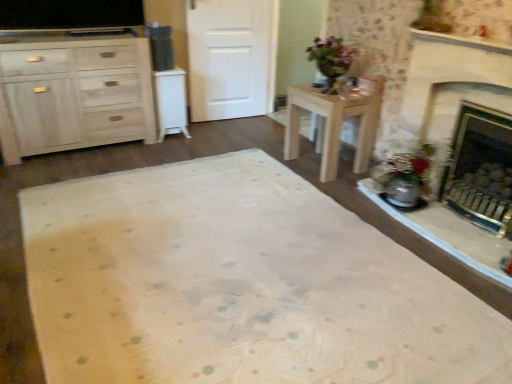
How much space does white matte cabinet at left, marked as the 1th cabinetry in a right-to-left arrangement, occupy vertically?

21.58 inches.

What do you see at coordinates (74, 93) in the screenshot?
I see `light wood cabinet at left, the first cabinetry when ordered from left to right` at bounding box center [74, 93].

Identify the location of light wood cabinet at left, the first cabinetry when ordered from left to right. (74, 93).

You are a GUI agent. You are given a task and a screenshot of the screen. Output one action in this format:
    pyautogui.click(x=<x>, y=<y>)
    Task: Click on the brass fireplace at right
    The width and height of the screenshot is (512, 384).
    Given the screenshot: What is the action you would take?
    pyautogui.click(x=448, y=91)

In the scene shown: What is the approximate width of white matte door at center?

The width of white matte door at center is 4.08 inches.

You are a GUI agent. You are given a task and a screenshot of the screen. Output one action in this format:
    pyautogui.click(x=<x>, y=<y>)
    Task: Click on the light wood desk at center
    
    Given the screenshot: What is the action you would take?
    pyautogui.click(x=334, y=125)

Can we say white matte door at center lies outside white matte cabinet at left, marked as the 1th cabinetry in a right-to-left arrangement?

white matte door at center is positioned outside white matte cabinet at left, marked as the 1th cabinetry in a right-to-left arrangement.

Are white matte door at center and white matte cabinet at left, marked as the 1th cabinetry in a right-to-left arrangement, beside each other?

No, white matte door at center is not touching white matte cabinet at left, marked as the 1th cabinetry in a right-to-left arrangement.

Is white matte door at center positioned with its back to white matte cabinet at left, positioned as the 2th cabinetry in left-to-right order?

No, white matte door at center is not facing away from white matte cabinet at left, positioned as the 2th cabinetry in left-to-right order.

Can you confirm if light wood desk at center is smaller than light wood cabinet at left, the first cabinetry when ordered from left to right?

Yes, light wood desk at center is smaller than light wood cabinet at left, the first cabinetry when ordered from left to right.

Does light wood desk at center turn towards light wood cabinet at left, the first cabinetry when ordered from left to right?

No.

Is light wood desk at center in contact with light wood cabinet at left, the first cabinetry when ordered from left to right?

No, light wood desk at center is not in contact with light wood cabinet at left, the first cabinetry when ordered from left to right.

Is brass fireplace at right closer to camera compared to light wood cabinet at left, arranged as the second cabinetry when viewed from the right?

Yes, it is in front of light wood cabinet at left, arranged as the second cabinetry when viewed from the right.

From the image's perspective, would you say brass fireplace at right is shown under light wood cabinet at left, the first cabinetry when ordered from left to right?

Yes, from the image's perspective, brass fireplace at right is beneath light wood cabinet at left, the first cabinetry when ordered from left to right.

From a real-world perspective, is brass fireplace at right over light wood cabinet at left, the first cabinetry when ordered from left to right?

Yes, from a real-world perspective, brass fireplace at right is over light wood cabinet at left, the first cabinetry when ordered from left to right

Where is `fireplace in front of the light wood cabinet at left, the first cabinetry when ordered from left to right`? The width and height of the screenshot is (512, 384). fireplace in front of the light wood cabinet at left, the first cabinetry when ordered from left to right is located at coordinates (448, 91).

Between light wood cabinet at left, arranged as the second cabinetry when viewed from the right, and light wood desk at center, which one is positioned behind?

light wood desk at center is further from the camera.

Is light wood cabinet at left, arranged as the second cabinetry when viewed from the right, positioned far away from light wood desk at center?

light wood cabinet at left, arranged as the second cabinetry when viewed from the right, is far away from light wood desk at center.

I want to click on desk behind the light wood cabinet at left, arranged as the second cabinetry when viewed from the right, so click(x=334, y=125).

Which is closer, (98, 132) or (338, 128)?

Clearly, point (98, 132) is more distant from the camera than point (338, 128).

Is brass fireplace at right not within light wood desk at center?

brass fireplace at right lies outside light wood desk at center's area.

Is brass fireplace at right touching light wood desk at center?

No, brass fireplace at right is not with light wood desk at center.

Is point (465, 256) less distant than point (324, 132)?

Yes, it is in front of point (324, 132).

Considering the sizes of objects light wood cabinet at left, arranged as the second cabinetry when viewed from the right, and white matte cabinet at left, marked as the 1th cabinetry in a right-to-left arrangement, in the image provided, who is taller, light wood cabinet at left, arranged as the second cabinetry when viewed from the right, or white matte cabinet at left, marked as the 1th cabinetry in a right-to-left arrangement,?

Standing taller between the two is light wood cabinet at left, arranged as the second cabinetry when viewed from the right.

Who is bigger, light wood cabinet at left, the first cabinetry when ordered from left to right, or white matte cabinet at left, marked as the 1th cabinetry in a right-to-left arrangement?

light wood cabinet at left, the first cabinetry when ordered from left to right, is bigger.

What's the angular difference between light wood cabinet at left, the first cabinetry when ordered from left to right, and white matte cabinet at left, positioned as the 2th cabinetry in left-to-right order,'s facing directions?

There is a 0.657-degree angle between the facing directions of light wood cabinet at left, the first cabinetry when ordered from left to right, and white matte cabinet at left, positioned as the 2th cabinetry in left-to-right order.

Is light wood cabinet at left, arranged as the second cabinetry when viewed from the right, to the left or to the right of white matte cabinet at left, positioned as the 2th cabinetry in left-to-right order, in the image?

In the image, light wood cabinet at left, arranged as the second cabinetry when viewed from the right, appears on the left side of white matte cabinet at left, positioned as the 2th cabinetry in left-to-right order.

Can you tell me how much white matte cabinet at left, marked as the 1th cabinetry in a right-to-left arrangement, and light wood desk at center differ in facing direction?

89.1 degrees separate the facing orientations of white matte cabinet at left, marked as the 1th cabinetry in a right-to-left arrangement, and light wood desk at center.

Based on the photo, is white matte cabinet at left, marked as the 1th cabinetry in a right-to-left arrangement, surrounding light wood desk at center?

That's incorrect, light wood desk at center is not inside white matte cabinet at left, marked as the 1th cabinetry in a right-to-left arrangement.

Is white matte cabinet at left, positioned as the 2th cabinetry in left-to-right order, at the left side of light wood desk at center?

Indeed, white matte cabinet at left, positioned as the 2th cabinetry in left-to-right order, is positioned on the left side of light wood desk at center.

From a real-world perspective, count 2nd cabinetrys downward from the white matte door at center and point to it. Please provide its 2D coordinates.

[(170, 102)]

Find the location of a particular element. desk on the right of light wood cabinet at left, the first cabinetry when ordered from left to right is located at coordinates (334, 125).

From the image, which object appears to be nearer to white matte cabinet at left, positioned as the 2th cabinetry in left-to-right order, light wood cabinet at left, the first cabinetry when ordered from left to right, or brass fireplace at right?

light wood cabinet at left, the first cabinetry when ordered from left to right, lies closer to white matte cabinet at left, positioned as the 2th cabinetry in left-to-right order, than the other object.

Based on their spatial positions, is light wood desk at center or white matte cabinet at left, positioned as the 2th cabinetry in left-to-right order, closer to brass fireplace at right?

The object closer to brass fireplace at right is light wood desk at center.

From the image, which object appears to be farther from light wood cabinet at left, arranged as the second cabinetry when viewed from the right, white matte cabinet at left, positioned as the 2th cabinetry in left-to-right order, or white matte door at center?

white matte door at center is positioned further to the anchor light wood cabinet at left, arranged as the second cabinetry when viewed from the right.

Consider the image. Looking at the image, which one is located closer to white matte cabinet at left, marked as the 1th cabinetry in a right-to-left arrangement, light wood desk at center or light wood cabinet at left, the first cabinetry when ordered from left to right?

light wood cabinet at left, the first cabinetry when ordered from left to right, is positioned closer to the anchor white matte cabinet at left, marked as the 1th cabinetry in a right-to-left arrangement.

Which object lies further to the anchor point light wood desk at center, white matte door at center or brass fireplace at right?

The object further to light wood desk at center is white matte door at center.

Looking at the image, which one is located further to white matte door at center, light wood desk at center or light wood cabinet at left, arranged as the second cabinetry when viewed from the right?

light wood desk at center.

Consider the image. Which object lies further to the anchor point light wood cabinet at left, arranged as the second cabinetry when viewed from the right, white matte cabinet at left, marked as the 1th cabinetry in a right-to-left arrangement, or light wood desk at center?

Among the two, light wood desk at center is located further to light wood cabinet at left, arranged as the second cabinetry when viewed from the right.

Considering their positions, is light wood cabinet at left, the first cabinetry when ordered from left to right, positioned closer to brass fireplace at right than white matte cabinet at left, positioned as the 2th cabinetry in left-to-right order?

white matte cabinet at left, positioned as the 2th cabinetry in left-to-right order.

Where is `cabinetry between light wood cabinet at left, arranged as the second cabinetry when viewed from the right, and white matte door at center`? This screenshot has height=384, width=512. cabinetry between light wood cabinet at left, arranged as the second cabinetry when viewed from the right, and white matte door at center is located at coordinates (170, 102).

The height and width of the screenshot is (384, 512). I want to click on door between white matte cabinet at left, positioned as the 2th cabinetry in left-to-right order, and light wood desk at center, in the horizontal direction, so (x=231, y=57).

Where is `door between white matte cabinet at left, marked as the 1th cabinetry in a right-to-left arrangement, and brass fireplace at right from left to right`? This screenshot has height=384, width=512. door between white matte cabinet at left, marked as the 1th cabinetry in a right-to-left arrangement, and brass fireplace at right from left to right is located at coordinates (231, 57).

Locate an element on the screen. door between light wood cabinet at left, arranged as the second cabinetry when viewed from the right, and light wood desk at center is located at coordinates (231, 57).